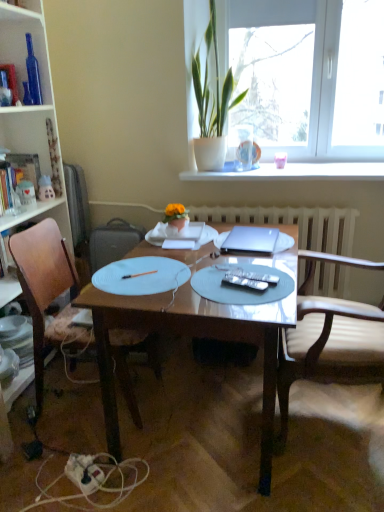
Where is `vacant area that is in front of silver metallic remote control at center`? vacant area that is in front of silver metallic remote control at center is located at coordinates (251, 304).